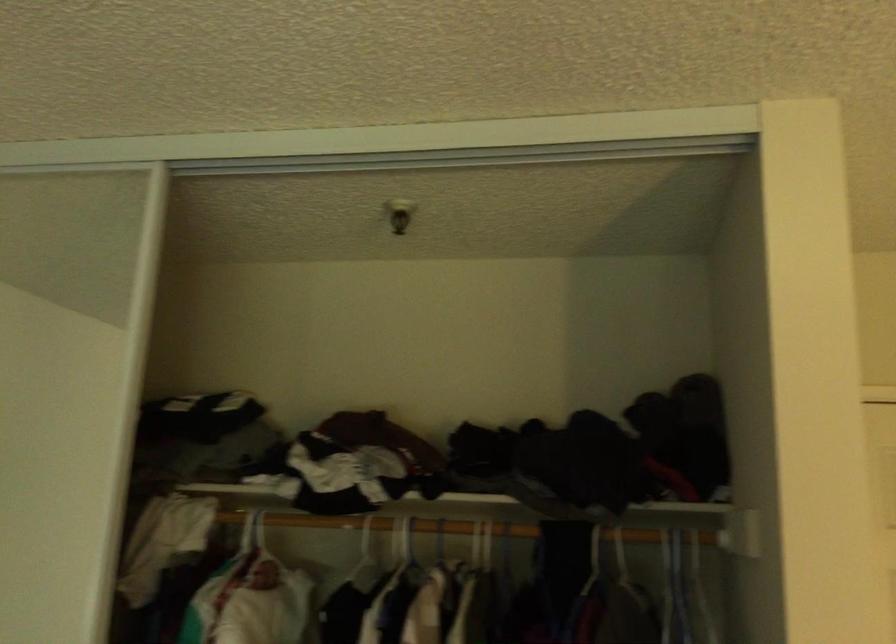
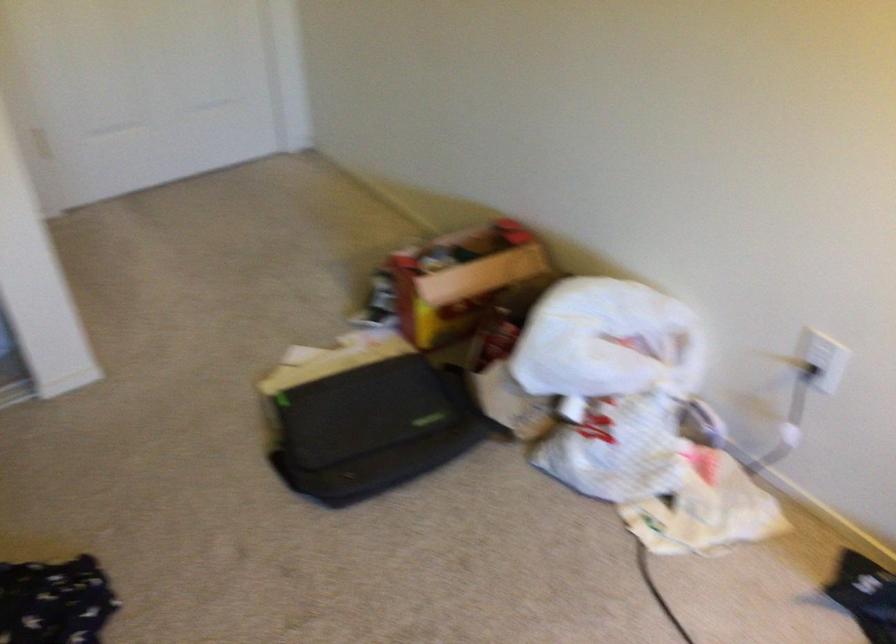
In the scene shown: How did the camera likely rotate?

The camera rotated toward right-down.